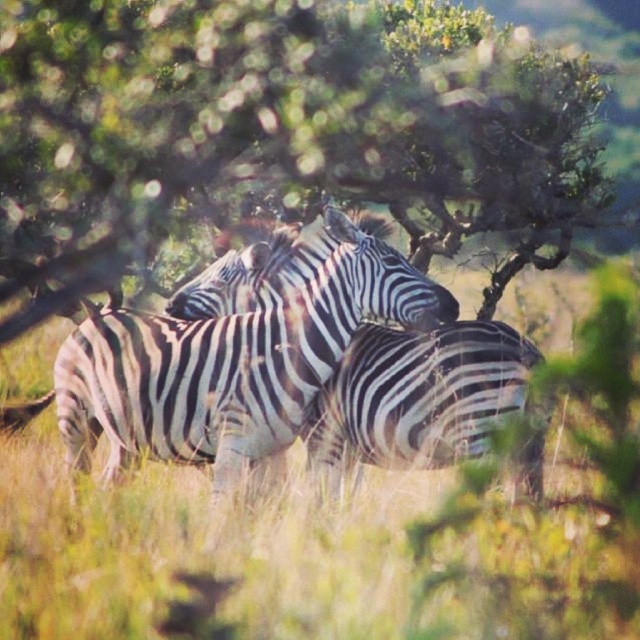
You are standing in the savanna and see two points marked on the ground. The first point is at coordinate point (502, 513) and the second is at point (470, 372). Which point is closer to you?

Point (502, 513) is in front of point (470, 372), so it is closer to you.

You are a photographer trying to capture a photo of both the green leafy tree at center and the black and white striped zebra at center. Based on their heights, which one should you focus on first to ensure both are in frame?

The green leafy tree at center is not as tall as the black and white striped zebra at center, so you should focus on the black and white striped zebra at center first to ensure both are in frame.